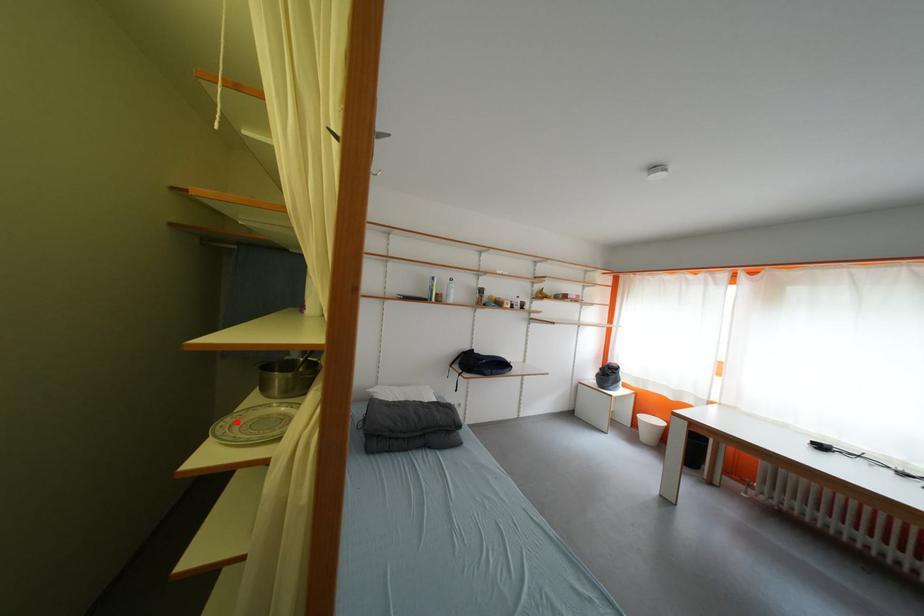
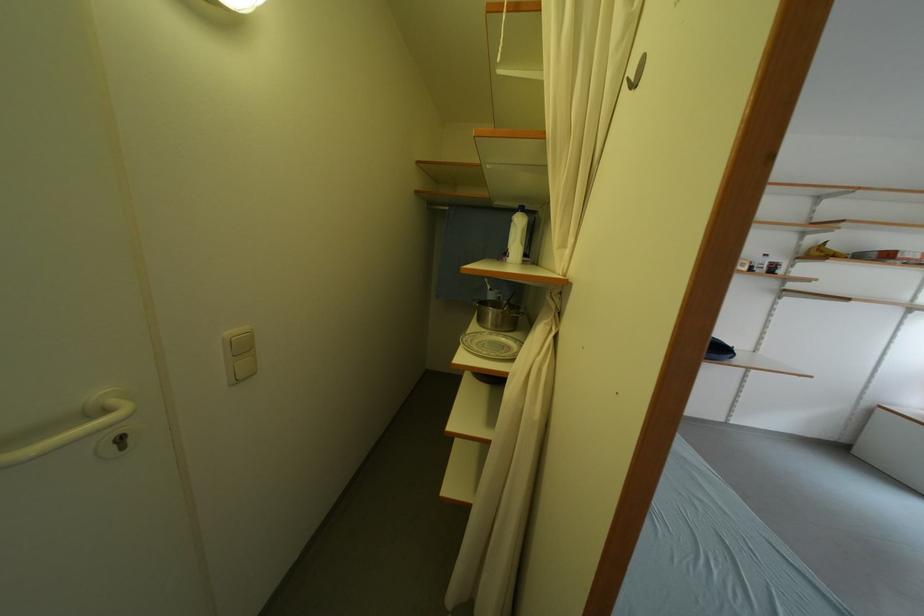
Locate, in the second image, the point that corresponds to the highlighted location in the first image.

(476, 339)